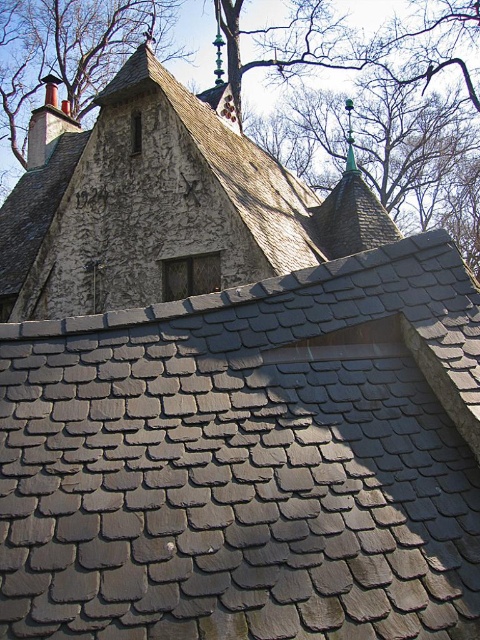
You are an architect evaluating the building. You see both the gray slate roof at upper center and the green textured roof at upper center. Which one has a larger surface area?

The gray slate roof at upper center is smaller than the green textured roof at upper center, so the green textured roof at upper center has a larger surface area.

You are an architect analyzing the building facade. You observe the dark gray slate tile roof at upper center and the green textured roof at upper center. Which roof is positioned to the right side of the other?

The dark gray slate tile roof at upper center is to the right of the green textured roof at upper center.

You are standing in front of the building and want to take a photo of the dark gray slate tile roof at upper center. If your camera has a maximum focus range of 6 meters, will it be able to capture the roof clearly?

The dark gray slate tile roof at upper center is 6.63 meters away from the camera. Since the maximum focus range is 6 meters, the camera cannot focus on the roof clearly.